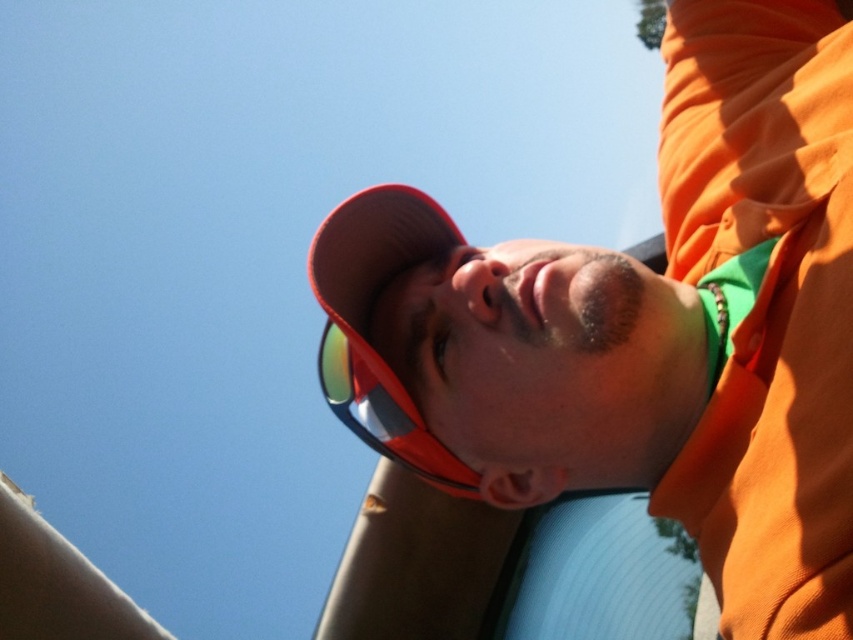
Question: Can you confirm if matte orange cap at center is smaller than green reflective lens at center?

Choices:
 (A) no
 (B) yes

Answer: (A)

Question: Which point appears closest to the camera in this image?

Choices:
 (A) (329, 362)
 (B) (785, 452)

Answer: (B)

Question: Which point is closer to the camera?

Choices:
 (A) (427, 250)
 (B) (422, 429)

Answer: (B)

Question: Among these points, which one is farthest from the camera?

Choices:
 (A) (451, 492)
 (B) (828, 124)

Answer: (A)

Question: Does matte orange cap at center have a greater width compared to green reflective lens at center?

Choices:
 (A) no
 (B) yes

Answer: (B)

Question: Does matte orange cap at center appear under green reflective lens at center?

Choices:
 (A) yes
 (B) no

Answer: (B)